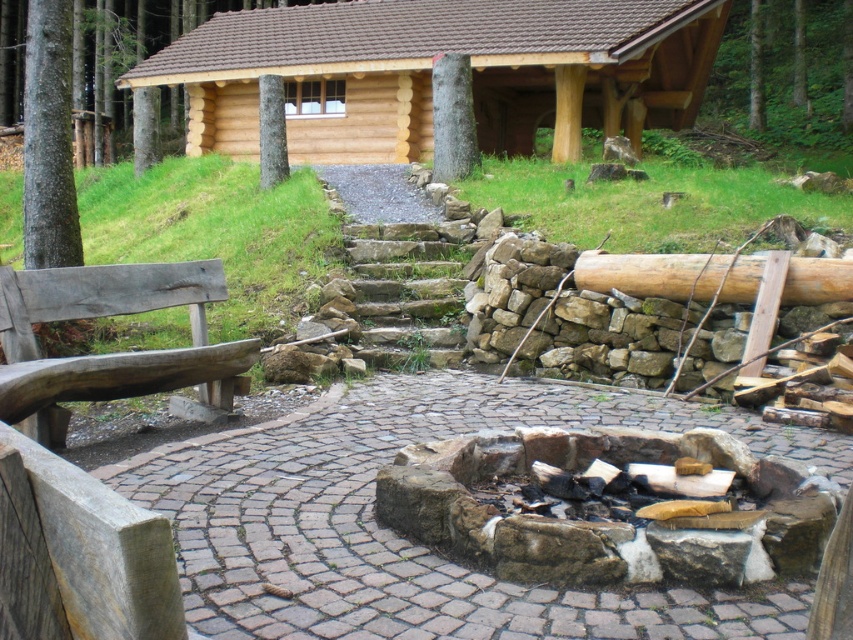
You are standing on the cobblestone patio near the fire pit and want to reach the wooden cabin at upper center. Which direction should you move relative to the wooden bench at left?

The wooden cabin at upper center is located above the wooden bench at left, so you should move towards the upper direction from the wooden bench at left to reach the cabin.

You are planning to set up a small tent between the wooden cabin at upper center and the wooden bench at left. Based on their widths, which object should you place the tent closer to to ensure it fits comfortably?

The wooden cabin at upper center is wider than the wooden bench at left, so placing the tent closer to the wooden bench at left would provide more space for the tent to fit comfortably.

You are planning to set up a tent between the wooden cabin at upper center and the wooden bench at left. Given that the tent requires a minimum of 10 meters of space between the cabin and the bench to be placed safely, will there be enough space?

The wooden cabin at upper center and wooden bench at left are 12.88 meters apart from each other, so yes, there is enough space to set up the tent safely between them since the distance exceeds the required 10 meters.